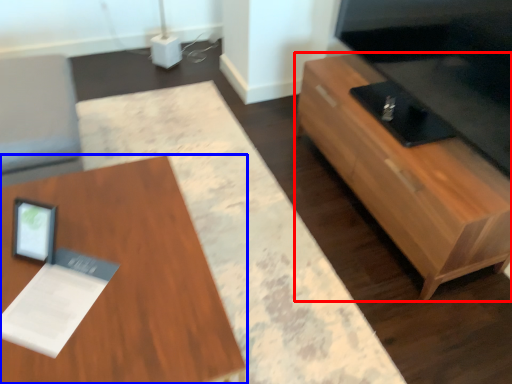
Question: Which object appears closest to the camera in this image, table (highlighted by a red box) or table (highlighted by a blue box)?

Choices:
 (A) table
 (B) table

Answer: (B)